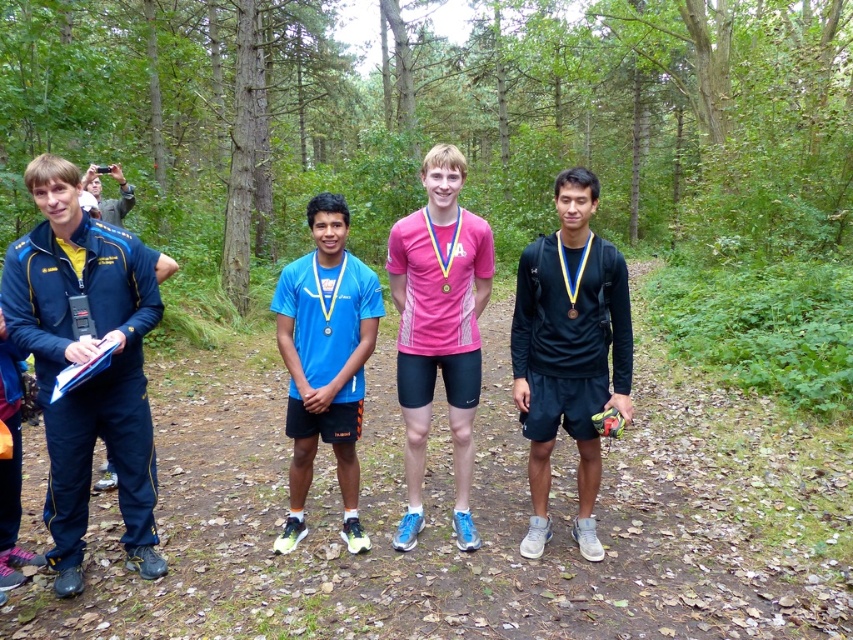
Question: Observing the image, what is the correct spatial positioning of brown dirt trail at center in reference to gold metallic medal at center?

Choices:
 (A) left
 (B) right

Answer: (A)

Question: Which of the following is the farthest from the observer?

Choices:
 (A) (283, 534)
 (B) (120, 173)
 (C) (103, 323)
 (D) (624, 416)

Answer: (B)

Question: Which of these objects is positioned farthest from the black matte shirt at center?

Choices:
 (A) matte black jacket at left
 (B) brown dirt trail at center
 (C) gold metallic medal at center

Answer: (A)

Question: Does brown dirt trail at center appear under blue fabric jacket at left?

Choices:
 (A) no
 (B) yes

Answer: (B)

Question: Which object is the closest to the gold metallic medal at center?

Choices:
 (A) black matte shirt at center
 (B) brown dirt trail at center
 (C) matte black jacket at left

Answer: (A)

Question: Is blue fabric jacket at left smaller than matte black jacket at left?

Choices:
 (A) no
 (B) yes

Answer: (A)